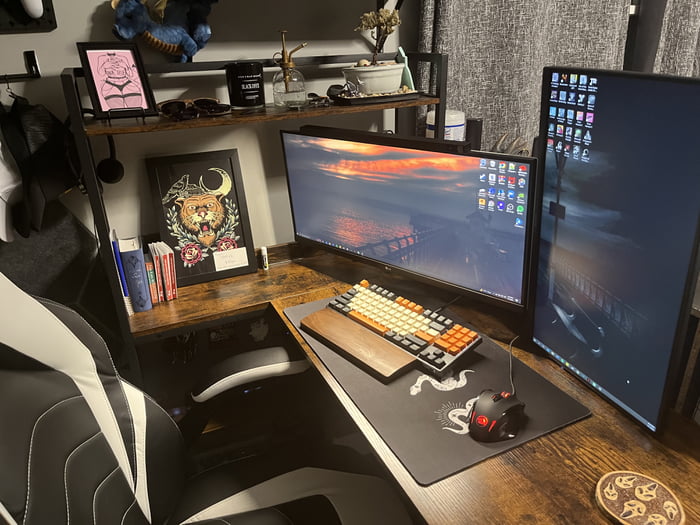
Identify the location of cabled computer mouse. (491, 400).